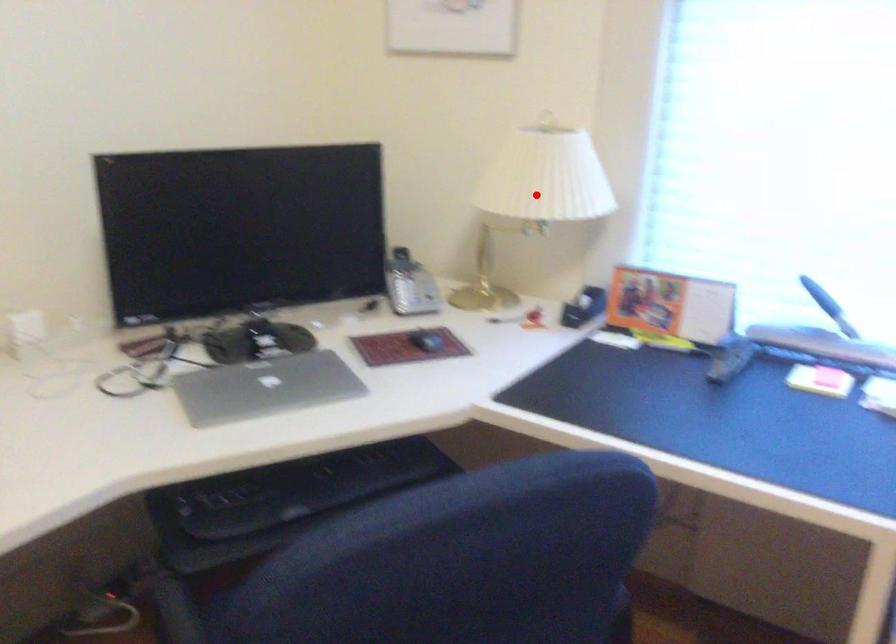
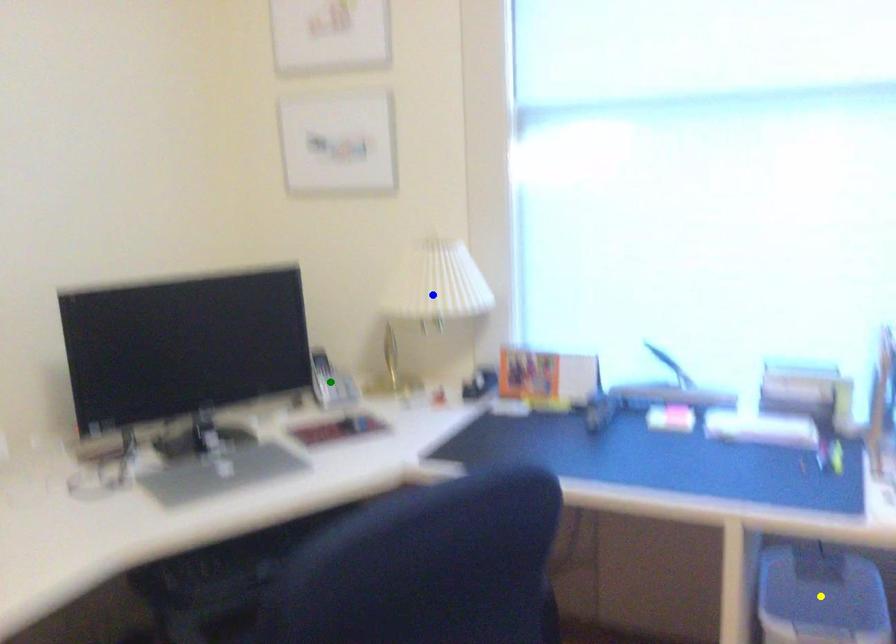
Question: I am providing you with two images of the same scene from different viewpoints. A red point is marked on the first image. You are given multiple points on the second image. In image 2, which mark is for the same physical point as the one in image 1?

Choices:
 (A) yellow point
 (B) green point
 (C) blue point

Answer: (C)